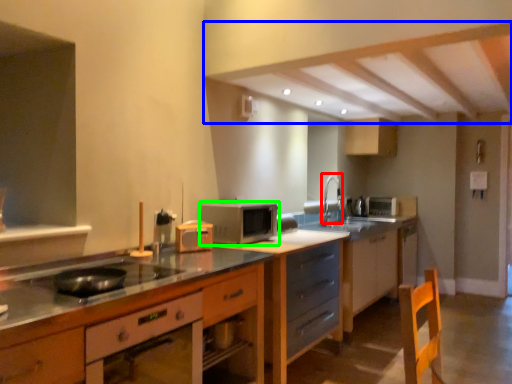
Question: Considering the real-world distances, which object is farthest from faucet (highlighted by a red box)? exhaust hood (highlighted by a blue box) or microwave oven (highlighted by a green box)?

Choices:
 (A) exhaust hood
 (B) microwave oven

Answer: (A)